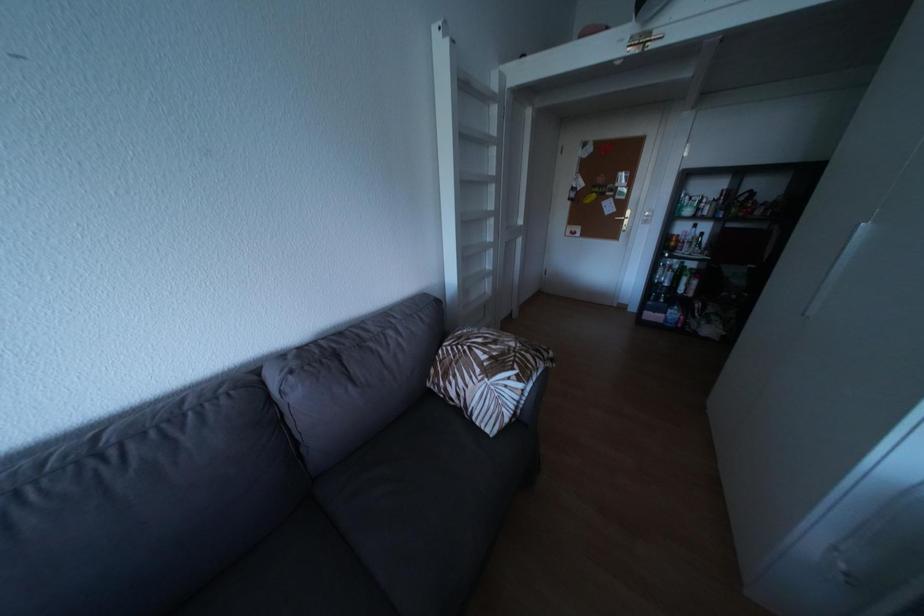
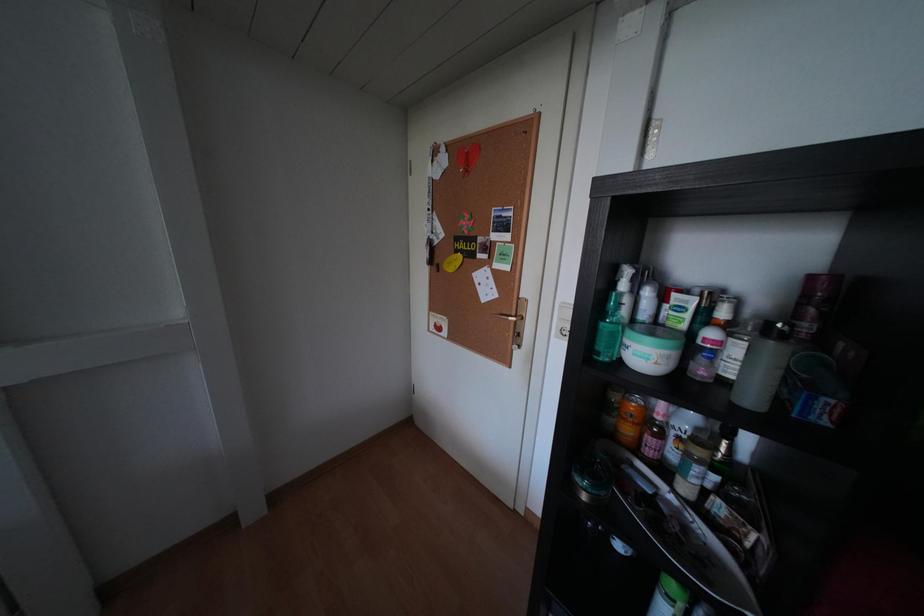
The images are taken continuously from a first-person perspective. In which direction are you moving?

The movement direction of the cameraman is right, forward.